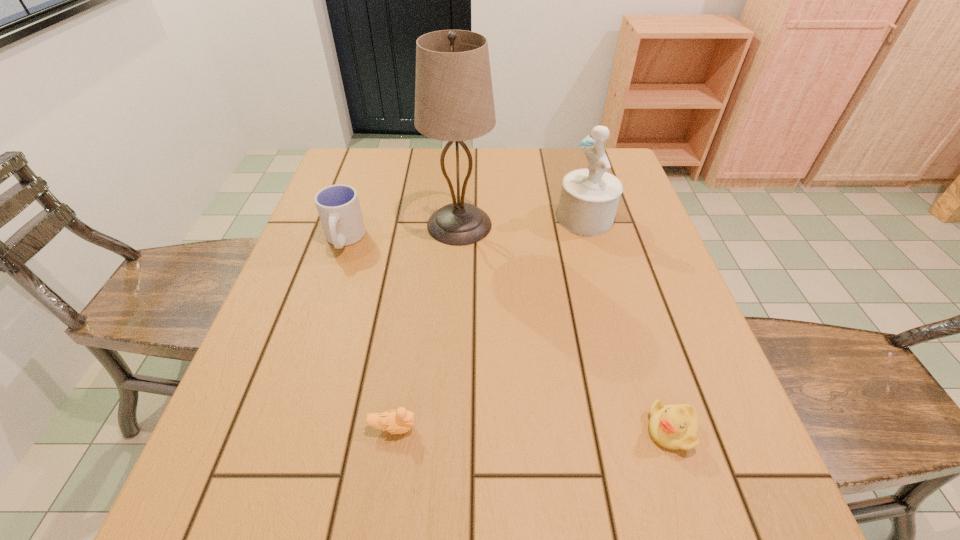
Where is `lampshade`? The width and height of the screenshot is (960, 540). lampshade is located at coordinates (454, 101).

At what (x,y) coordinates should I click in order to perform the action: click on the second tallest object. Please return your answer as a coordinate pair (x, y). Looking at the image, I should click on (589, 197).

Where is `the leftmost object`? This screenshot has height=540, width=960. the leftmost object is located at coordinates (338, 206).

Locate an element on the screen. This screenshot has height=540, width=960. the third tallest object is located at coordinates (338, 206).

You are a GUI agent. You are given a task and a screenshot of the screen. Output one action in this format:
    pyautogui.click(x=<x>, y=<y>)
    Task: Click on the right duckling
    Image resolution: width=960 pixels, height=540 pixels.
    Given the screenshot: What is the action you would take?
    pyautogui.click(x=674, y=427)

I want to click on the left duckling, so click(x=399, y=421).

Locate an element on the screen. free location located 0.150m on the front-facing side of the tallest object is located at coordinates (551, 225).

At what (x,y) coordinates should I click in order to perform the action: click on free space located 0.350m at the beak of the second tallest object. Please return your answer as a coordinate pair (x, y). This screenshot has width=960, height=540. Looking at the image, I should click on (425, 219).

Where is `vacant space located 0.150m at the beak of the second tallest object`? This screenshot has width=960, height=540. vacant space located 0.150m at the beak of the second tallest object is located at coordinates (500, 219).

Locate an element on the screen. free location located at the beak of the second tallest object is located at coordinates (482, 219).